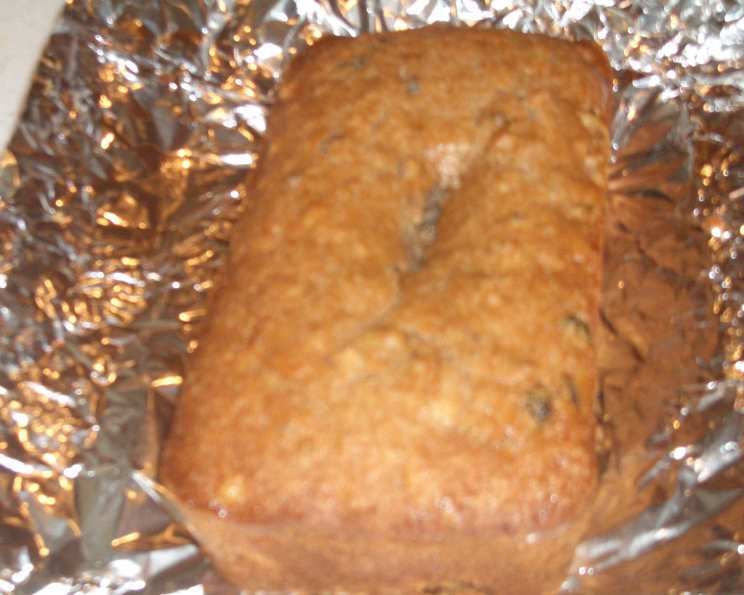
Locate an element on the screen. This screenshot has width=744, height=595. surface is located at coordinates (33, 45).